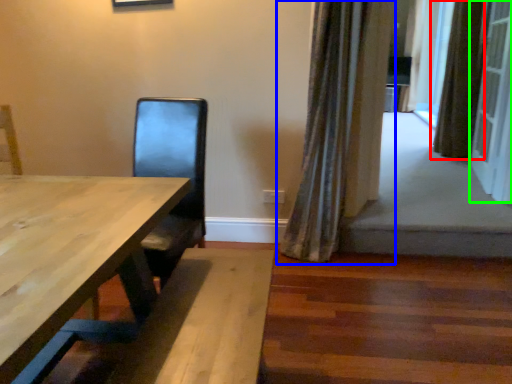
Question: Which is farther away from curtain (highlighted by a red box)? curtain (highlighted by a blue box) or screen door (highlighted by a green box)?

Choices:
 (A) curtain
 (B) screen door

Answer: (A)